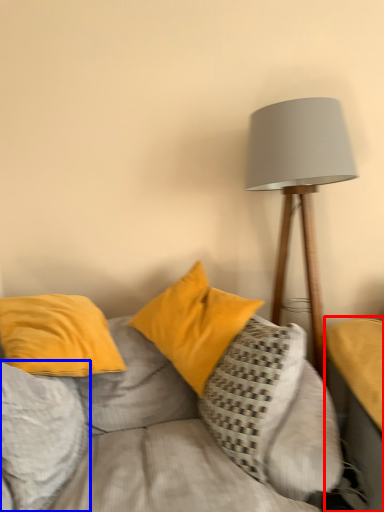
Question: Which object appears closest to the camera in this image, table (highlighted by a red box) or pillow (highlighted by a blue box)?

Choices:
 (A) table
 (B) pillow

Answer: (A)